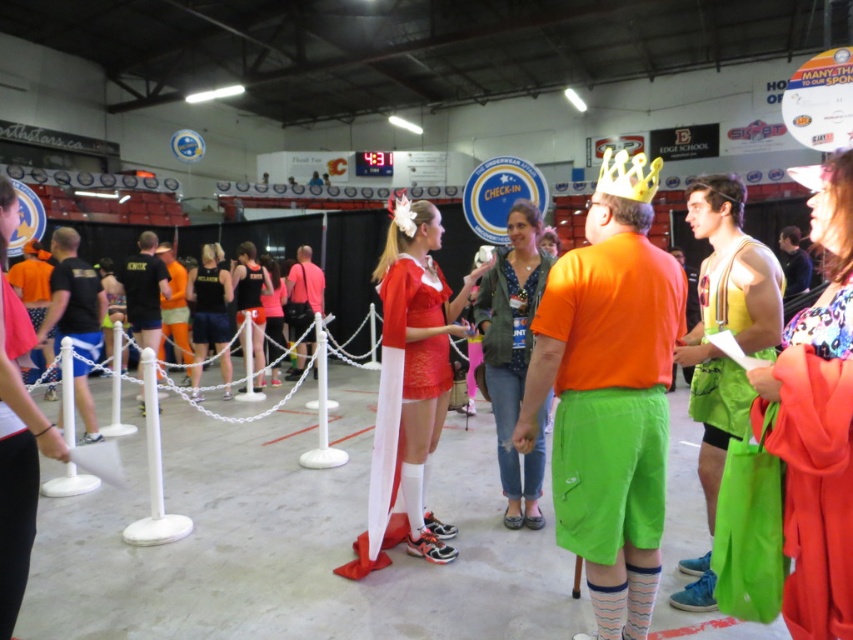
Based on the photo, you are standing at the entrance of the hall and want to take a photo of both the point at coordinates point (x=746, y=352) and point (x=312, y=298) in the scene. Which point should you focus on first to ensure both are in clear view?

You should focus on point (x=746, y=352) first because it is closer to the camera than point (x=312, y=298), ensuring both points are in clear view.

You are at an event and want to take a photo of the person wearing the yellow tank top at center and orange fabric shorts at center. To ensure both items are visible in the frame, where should you position the camera relative to the person?

The yellow tank top at center is positioned under orange fabric shorts at center, so you should position the camera so that it captures both the lower and upper parts of the person to ensure both items are visible.